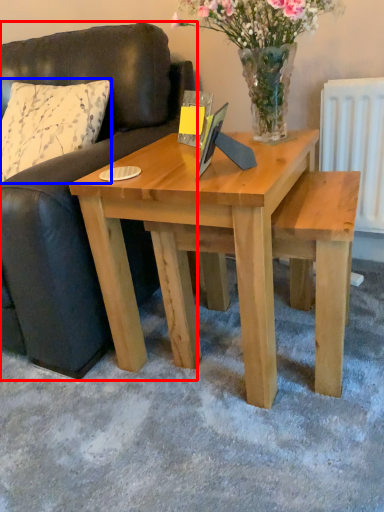
Question: Which point is closer to the camera, studio couch (highlighted by a red box) or pillow (highlighted by a blue box)?

Choices:
 (A) studio couch
 (B) pillow

Answer: (A)